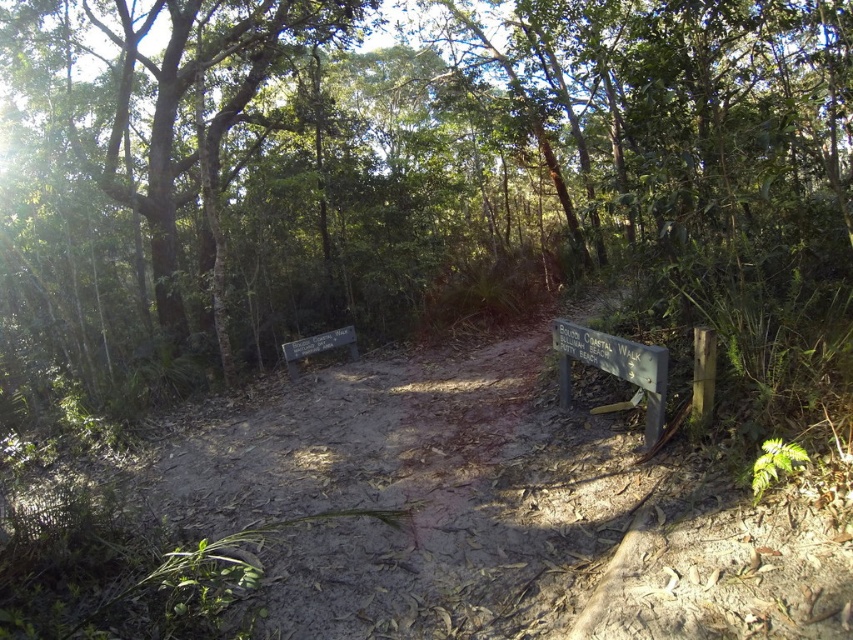
Is brown dirt track at center positioned before green leafy tree at left?

Yes, it is in front of green leafy tree at left.

Is point (741, 572) positioned behind point (155, 186)?

No.

Between point (546, 442) and point (271, 58), which one is positioned behind?

Positioned behind is point (271, 58).

Image resolution: width=853 pixels, height=640 pixels. I want to click on brown dirt track at center, so click(x=488, y=509).

Does wooden sign at center-right lie behind wooden sign at center?

No, wooden sign at center-right is in front of wooden sign at center.

Between point (662, 364) and point (325, 346), which one is positioned behind?

Point (325, 346)

At what (x,y) coordinates should I click in order to perform the action: click on wooden sign at center-right. Please return your answer as a coordinate pair (x, y). Image resolution: width=853 pixels, height=640 pixels. Looking at the image, I should click on (614, 368).

Between brown dirt track at center and wooden sign at center, which one is positioned higher?

wooden sign at center

Is brown dirt track at center smaller than wooden sign at center?

No.

Identify the location of brown dirt track at center. (488, 509).